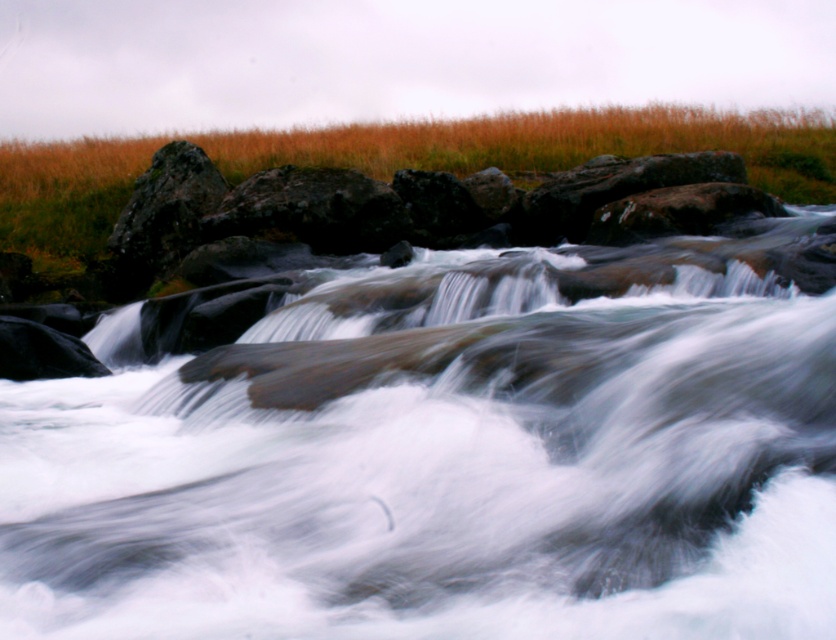
Question: Which point appears farthest from the camera in this image?

Choices:
 (A) (670, 464)
 (B) (84, 259)

Answer: (B)

Question: Can you confirm if white smooth water at center is wider than golden grass at upper center?

Choices:
 (A) no
 (B) yes

Answer: (A)

Question: From the image, what is the correct spatial relationship of white smooth water at center in relation to golden grass at upper center?

Choices:
 (A) above
 (B) below

Answer: (B)

Question: Which object appears farthest from the camera in this image?

Choices:
 (A) white smooth water at center
 (B) golden grass at upper center

Answer: (B)

Question: Can you confirm if white smooth water at center is thinner than golden grass at upper center?

Choices:
 (A) no
 (B) yes

Answer: (B)